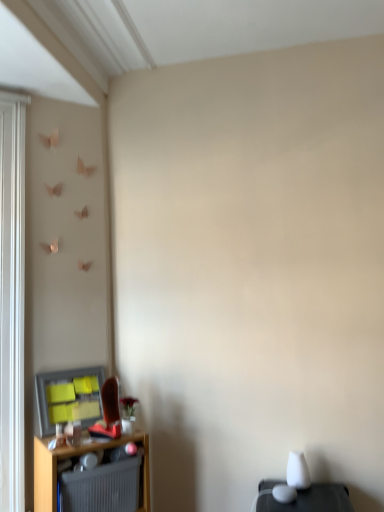
Question: Is gray ribbed radiator at lower left positioned far away from matte plastic window screen at lower left?

Choices:
 (A) yes
 (B) no

Answer: (B)

Question: Is gray ribbed radiator at lower left further to the viewer compared to matte plastic window screen at lower left?

Choices:
 (A) no
 (B) yes

Answer: (A)

Question: Does gray ribbed radiator at lower left have a lesser width compared to matte plastic window screen at lower left?

Choices:
 (A) yes
 (B) no

Answer: (B)

Question: Is gray ribbed radiator at lower left next to matte plastic window screen at lower left and touching it?

Choices:
 (A) yes
 (B) no

Answer: (B)

Question: Considering the relative sizes of gray ribbed radiator at lower left and matte plastic window screen at lower left in the image provided, is gray ribbed radiator at lower left taller than matte plastic window screen at lower left?

Choices:
 (A) no
 (B) yes

Answer: (A)

Question: Is gray ribbed radiator at lower left turned away from matte plastic window screen at lower left?

Choices:
 (A) yes
 (B) no

Answer: (B)

Question: Is wooden shelf at lower left to the right of gray ribbed radiator at lower left from the viewer's perspective?

Choices:
 (A) no
 (B) yes

Answer: (A)

Question: Does wooden shelf at lower left have a lesser width compared to gray ribbed radiator at lower left?

Choices:
 (A) no
 (B) yes

Answer: (A)

Question: Is wooden shelf at lower left positioned in front of gray ribbed radiator at lower left?

Choices:
 (A) yes
 (B) no

Answer: (A)

Question: From the image's perspective, is wooden shelf at lower left beneath gray ribbed radiator at lower left?

Choices:
 (A) no
 (B) yes

Answer: (B)

Question: Is wooden shelf at lower left placed right next to gray ribbed radiator at lower left?

Choices:
 (A) yes
 (B) no

Answer: (B)

Question: Is wooden shelf at lower left wider than gray ribbed radiator at lower left?

Choices:
 (A) yes
 (B) no

Answer: (A)

Question: Is matte plastic window screen at lower left located outside gray ribbed radiator at lower left?

Choices:
 (A) no
 (B) yes

Answer: (B)